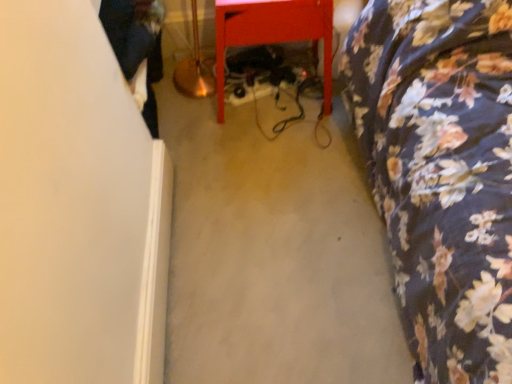
Question: Based on their sizes in the image, would you say dark blue jeans at left is bigger or smaller than floral fabric bedspread at right, placed as the 2th furniture when sorted from left to right?

Choices:
 (A) small
 (B) big

Answer: (A)

Question: Considering the positions of point (133, 56) and point (359, 102), is point (133, 56) closer or farther from the camera than point (359, 102)?

Choices:
 (A) closer
 (B) farther

Answer: (A)

Question: Considering the real-world distances, which object is farthest from the floral fabric bedspread at right, placed as the 2th furniture when sorted from left to right?

Choices:
 (A) matte red table at center, which ranks as the second furniture in right-to-left order
 (B) dark blue jeans at left

Answer: (B)

Question: Which object is the closest to the dark blue jeans at left?

Choices:
 (A) floral fabric bedspread at right, placed as the 2th furniture when sorted from left to right
 (B) matte red table at center, which ranks as the second furniture in right-to-left order

Answer: (B)